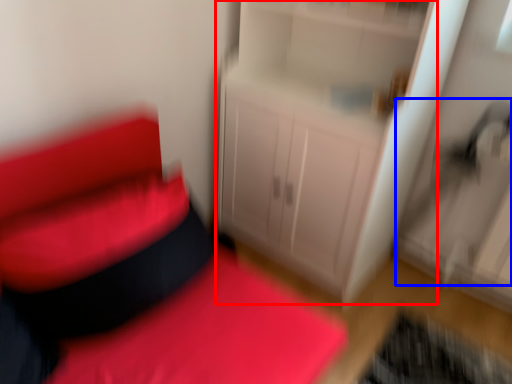
Question: Which point is further to the camera, dresser (highlighted by a red box) or swivel chair (highlighted by a blue box)?

Choices:
 (A) dresser
 (B) swivel chair

Answer: (B)